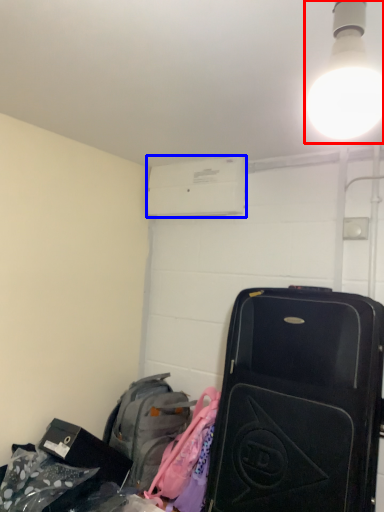
Question: Which object appears closest to the camera in this image, light fixture (highlighted by a red box) or air conditioning (highlighted by a blue box)?

Choices:
 (A) light fixture
 (B) air conditioning

Answer: (A)